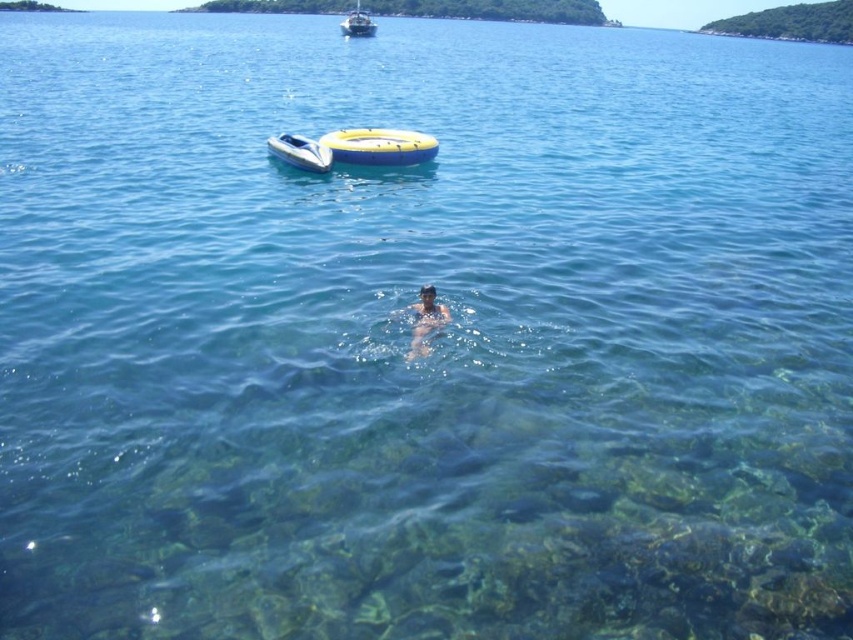
Question: Does skinny swimmer at center have a lesser width compared to white glossy boat at upper center?

Choices:
 (A) yes
 (B) no

Answer: (A)

Question: Can you confirm if skinny swimmer at center is positioned below white glossy boat at upper center?

Choices:
 (A) yes
 (B) no

Answer: (A)

Question: Which point appears closest to the camera in this image?

Choices:
 (A) (285, 160)
 (B) (426, 349)
 (C) (376, 156)
 (D) (343, 20)

Answer: (B)

Question: Does yellow rubber ring at upper center have a smaller size compared to skinny swimmer at center?

Choices:
 (A) no
 (B) yes

Answer: (B)

Question: Which of the following is the farthest from the observer?

Choices:
 (A) skinny swimmer at center
 (B) yellow rubber ring at upper center
 (C) white glossy boat at upper center

Answer: (C)

Question: Which point is closer to the camera?

Choices:
 (A) skinny swimmer at center
 (B) white plastic boat at upper center
 (C) yellow rubber ring at upper center
 (D) white glossy boat at upper center

Answer: (A)